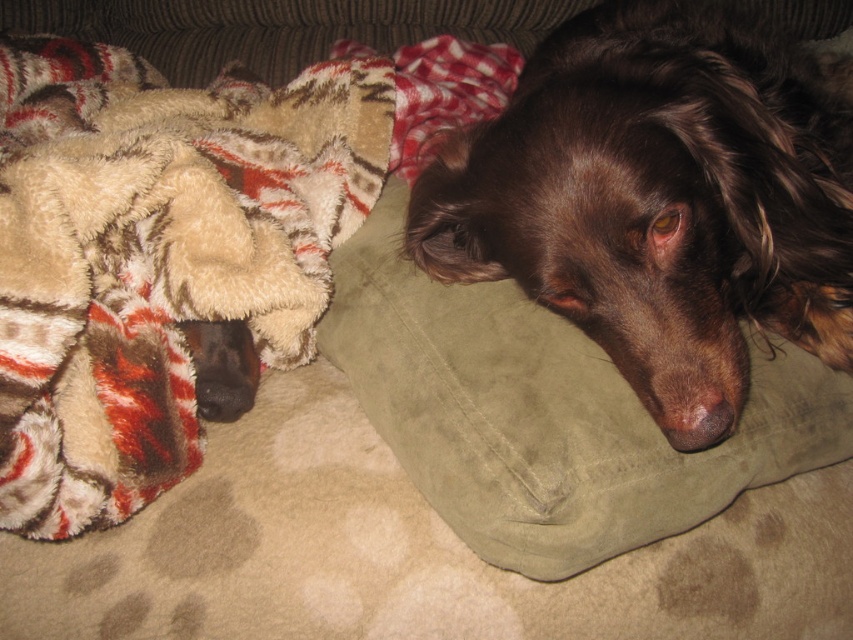
You are a pet owner who wants to place a new toy between the brown velvet dog at center and the suede pillow at center. Based on their sizes, which object should the toy be placed closer to?

The brown velvet dog at center is taller than the suede pillow at center, so the toy should be placed closer to the suede pillow at center to ensure stability and accessibility.

You are a pet sitter and need to place a new blanket over both the brown velvet dog at center and the suede pillow at center. Which object requires a larger blanket to cover it completely?

The brown velvet dog at center requires a larger blanket because it is larger in size than the suede pillow at center.

You are a pet owner who wants to move your dog from the suede pillow at center to the fuzzy beige blanket at left. Based on the scene description, can you determine which object is higher up so the dog can move upwards?

The fuzzy beige blanket at left is located above the suede pillow at center, so the dog can move upwards to the fuzzy beige blanket at left.